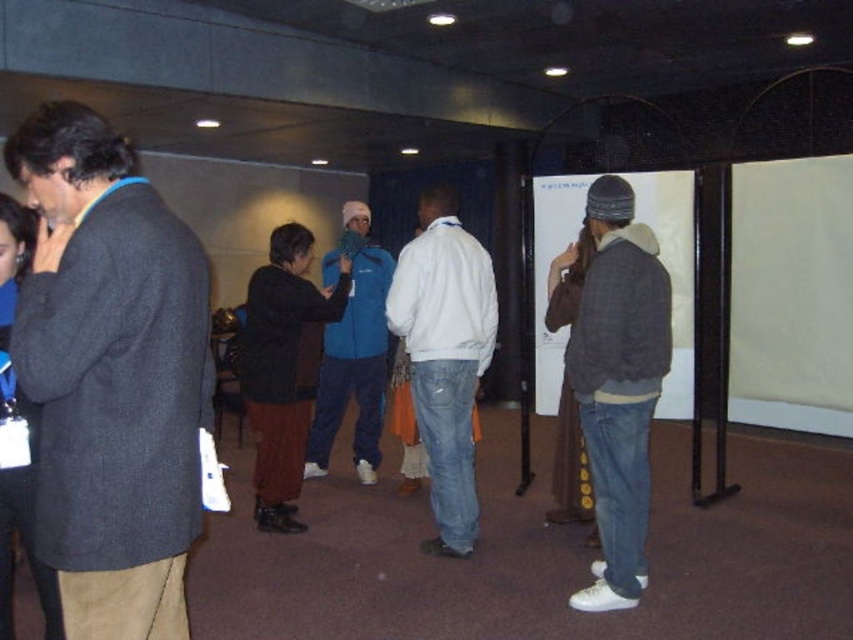
You are organizing a coat rack for an event and need to know which of the two jackets, the white matte jacket at center or the blue fleece jacket at center, takes up more space to decide their placement. Which one requires more space?

The blue fleece jacket at center requires more space because it occupies more space than the white matte jacket at center.

Based on the photo, you are standing in the conference room and need to present using the white matte projection screen at center. To do so, you must move from your current position near the dark gray wool coat at left. In which direction should you move relative to the screen?

You should move to the right relative to the white matte projection screen at center because the dark gray wool coat at left is to the left of the screen. Moving right will take you toward the screen.